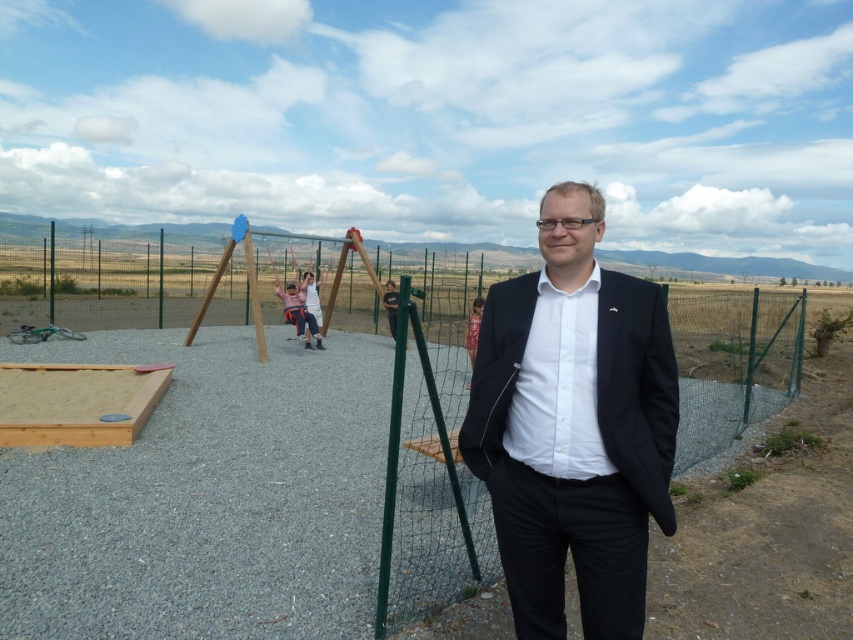
Can you confirm if wooden swing set at center is shorter than matte pink swing at center?

Incorrect, wooden swing set at center's height does not fall short of matte pink swing at center's.

Between point (413, 353) and point (285, 282), which one is positioned behind?

Positioned behind is point (285, 282).

Who is more forward, [80,570] or [299,292]?

Point [80,570]

This screenshot has height=640, width=853. Identify the location of wooden swing set at center. (206, 497).

Who is lower down, wooden swing set at center or black matte suit at center?

black matte suit at center is below.

How distant is wooden swing set at center from black matte suit at center?

A distance of 3.88 meters exists between wooden swing set at center and black matte suit at center.

Where is `wooden swing set at center`? Image resolution: width=853 pixels, height=640 pixels. wooden swing set at center is located at coordinates (206, 497).

What are the coordinates of `wooden swing set at center` in the screenshot? It's located at (206, 497).

Is wooden swing set at center above green wire mesh fence at right?

Incorrect, wooden swing set at center is not positioned above green wire mesh fence at right.

Is point (325, 497) closer to camera compared to point (676, 353)?

Yes, point (325, 497) is closer to viewer.

Which is in front, point (297, 355) or point (758, 344)?

Point (758, 344) is in front.

Image resolution: width=853 pixels, height=640 pixels. Find the location of `wooden swing set at center`. wooden swing set at center is located at coordinates (206, 497).